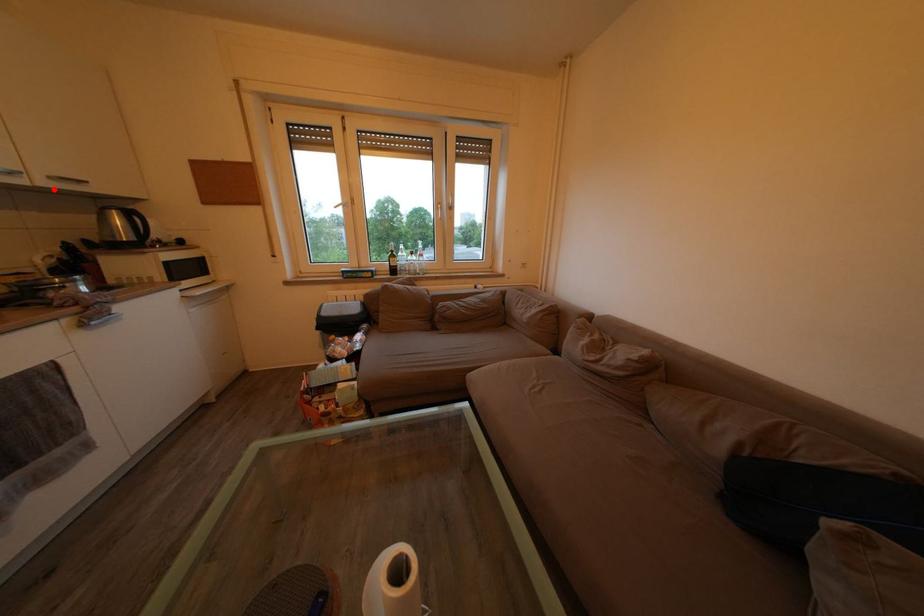
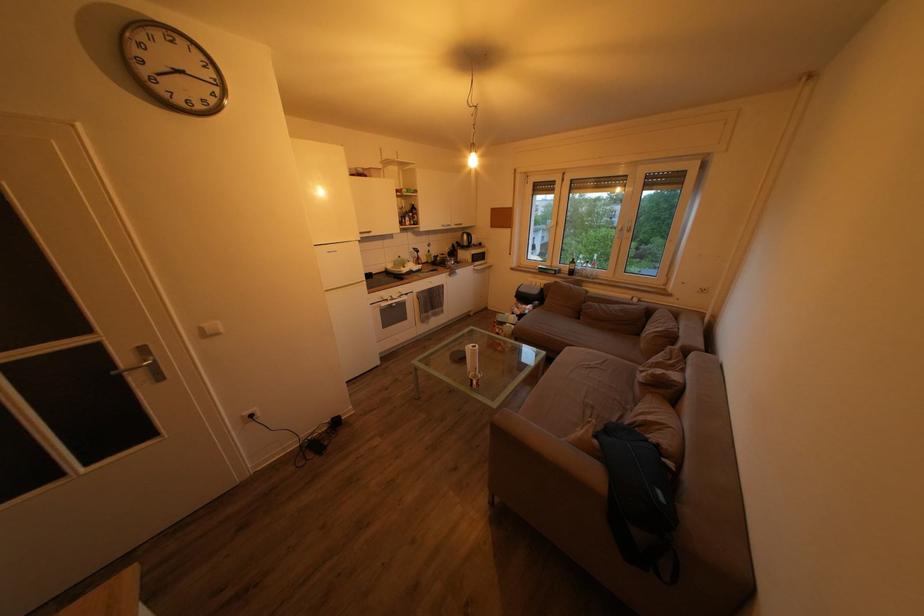
Find the pixel in the second image that matches the highlighted location in the first image.

(462, 233)